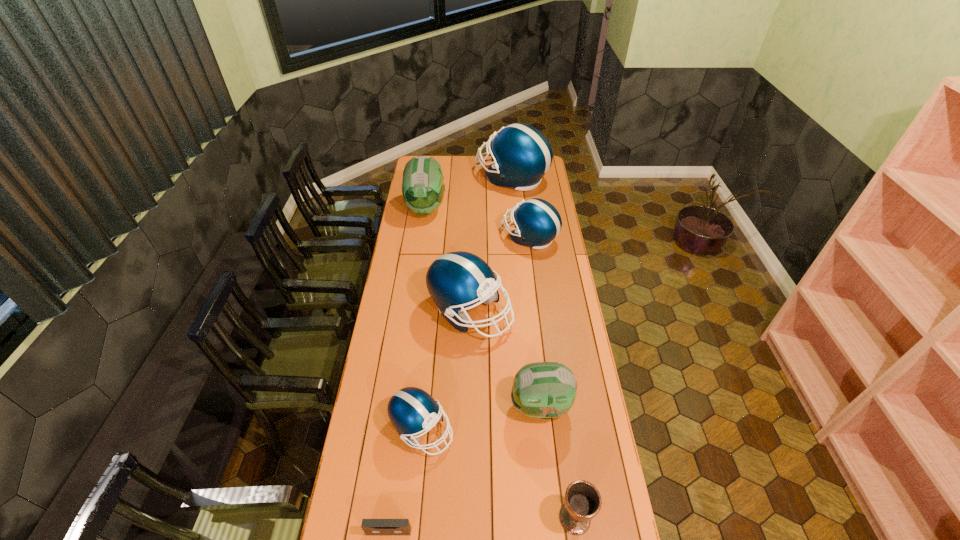
You are a GUI agent. You are given a task and a screenshot of the screen. Output one action in this format:
    pyautogui.click(x=<x>, y=<y>)
    Task: Click on the vacant area between the smallest blue football helmet and the fourth farthest football helmet
    Image resolution: width=960 pixels, height=540 pixels.
    Given the screenshot: What is the action you would take?
    point(446,371)

Locate an element on the screen. The height and width of the screenshot is (540, 960). the closest object relative to the tallest object is located at coordinates (423, 190).

Select which object is the fifth closest to the left green football helmet. Please provide its 2D coordinates. Your answer should be formatted as a tuple, i.e. [(x, y)], where the tuple contains the x and y coordinates of a point satisfying the conditions above.

[(411, 410)]

Where is `football helmet that can be found as the second closest to the farther green football helmet`? The height and width of the screenshot is (540, 960). football helmet that can be found as the second closest to the farther green football helmet is located at coordinates (537, 222).

Identify which football helmet is the closest to the nearer green football helmet. Please provide its 2D coordinates. Your answer should be formatted as a tuple, i.e. [(x, y)], where the tuple contains the x and y coordinates of a point satisfying the conditions above.

[(455, 280)]

You are a GUI agent. You are given a task and a screenshot of the screen. Output one action in this format:
    pyautogui.click(x=<x>, y=<y>)
    Task: Click on the blue football helmet that can be found as the second closest to the third smallest blue football helmet
    The height and width of the screenshot is (540, 960).
    Given the screenshot: What is the action you would take?
    pyautogui.click(x=411, y=410)

At what (x,y) coordinates should I click in order to perform the action: click on blue football helmet object that ranks as the closest to the second nearest blue football helmet. Please return your answer as a coordinate pair (x, y). The height and width of the screenshot is (540, 960). Looking at the image, I should click on (537, 222).

In order to click on vacant space that satisfies the following two spatial constraints: 1. at the front of the smallest blue football helmet with the faceguard; 2. on the back side of the chalice in this screenshot , I will do `click(413, 518)`.

I want to click on vacant space that satisfies the following two spatial constraints: 1. at the front of the tallest football helmet with the faceguard; 2. on the visor of the left green football helmet, so click(x=515, y=208).

The width and height of the screenshot is (960, 540). What are the coordinates of `blank space that satisfies the following two spatial constraints: 1. at the front of the second nearest blue football helmet with the faceguard; 2. on the front-facing side of the videotape` in the screenshot? It's located at (466, 531).